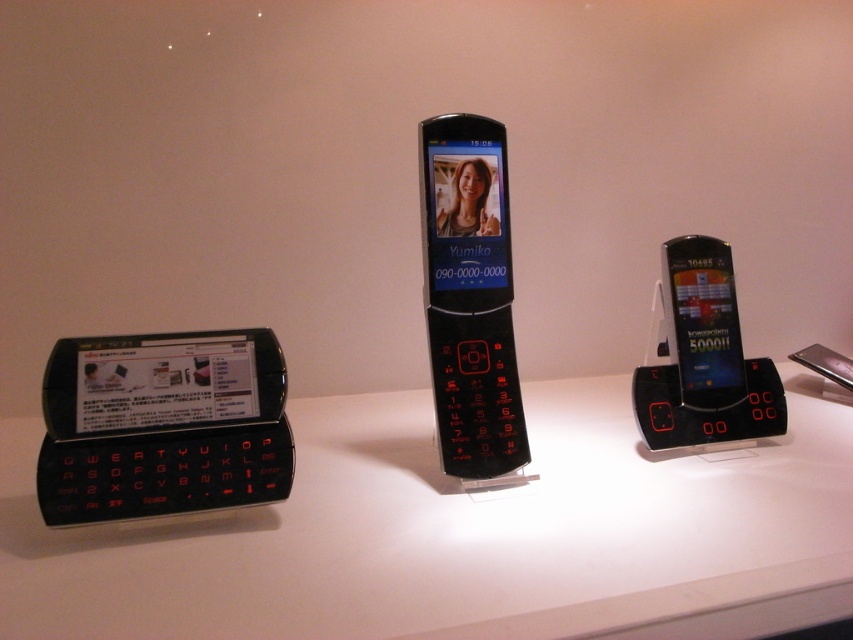
In the scene shown: You are standing 6 feet away from the image. Is the point at coordinates point (160, 440) closer to you than the edge of the image?

The point at coordinates point (160, 440) is 5.05 feet away from the camera, which is closer than the edge of the image since you are standing 6 feet away. Therefore, the point is within the visible area.

You are standing in front of the three mobile phones displayed on the white surface. There are two points marked on the image. Can you determine which point, point (845,600) or point (456,141), is closer to you?

Point (845,600) is closer to you because it is in front of point (456,141).

You are arranging these phones for a display. If you want to place a new phone between the black matte keyboard at left and the matte black phone at center, where should you position it?

The new phone should be placed between the black matte keyboard at left and the matte black phone at center, to the right of the black matte keyboard at left and to the left of the matte black phone at center since the keyboard is on the left side of the phone.